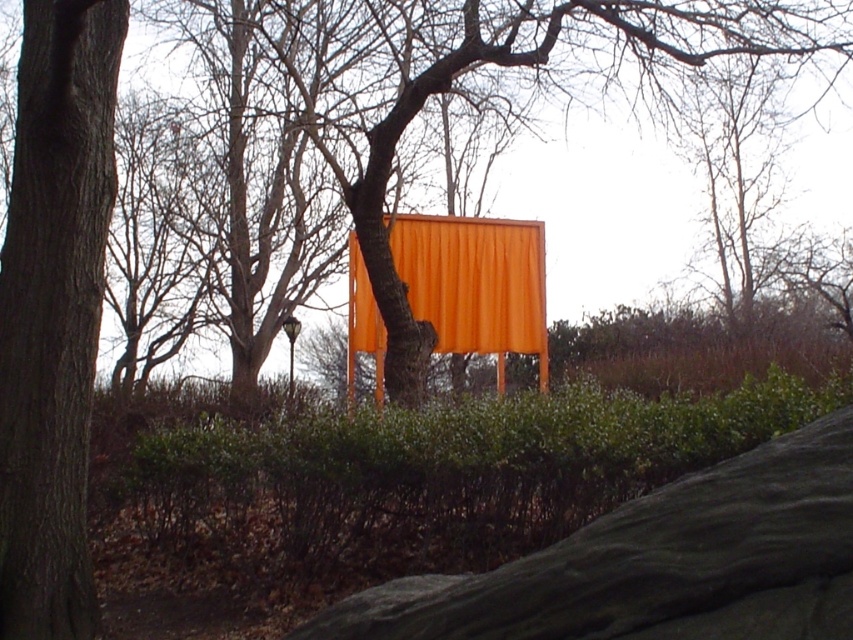
The height and width of the screenshot is (640, 853). Find the location of `smooth gray rock at center`. smooth gray rock at center is located at coordinates (659, 563).

Who is positioned more to the right, smooth gray rock at center or smooth brown tree trunk at left?

smooth gray rock at center

Image resolution: width=853 pixels, height=640 pixels. What do you see at coordinates (659, 563) in the screenshot? I see `smooth gray rock at center` at bounding box center [659, 563].

Find the location of a particular element. smooth gray rock at center is located at coordinates (659, 563).

Is point (62, 518) positioned behind point (463, 301)?

No.

Is smooth brown tree trunk at left above orange matte curtain at center?

Actually, smooth brown tree trunk at left is below orange matte curtain at center.

Does point (12, 483) come in front of point (428, 257)?

Yes, point (12, 483) is closer to viewer.

Identify the location of smooth brown tree trunk at left. (54, 310).

Between point (780, 573) and point (468, 268), which one is positioned behind?

Positioned behind is point (468, 268).

Locate an element on the screen. The image size is (853, 640). smooth gray rock at center is located at coordinates (659, 563).

Where is `smooth gray rock at center`? smooth gray rock at center is located at coordinates (659, 563).